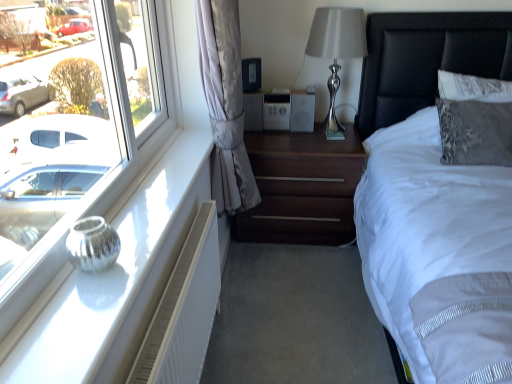
In order to click on free spot above white textured radiator at lower left (from a real-world perspective) in this screenshot , I will do `click(177, 276)`.